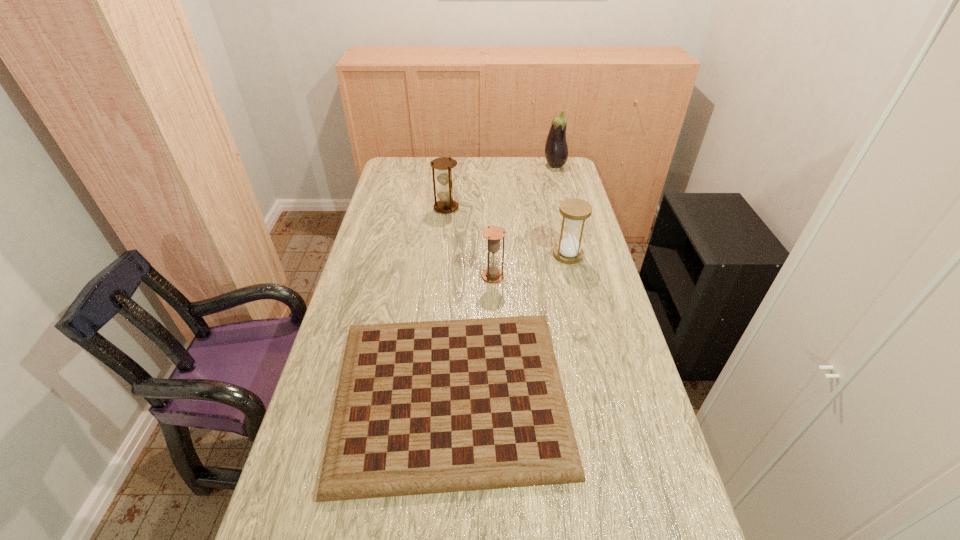
This screenshot has width=960, height=540. What are the coordinates of `blank region between the tallest object and the second hourglass from left to right` in the screenshot? It's located at (524, 221).

Identify which object is the fourth nearest to the farthest object. Please provide its 2D coordinates. Your answer should be formatted as a tuple, i.e. [(x, y)], where the tuple contains the x and y coordinates of a point satisfying the conditions above.

[(428, 407)]

Identify which object is the third closest to the gameboard. Please provide its 2D coordinates. Your answer should be formatted as a tuple, i.e. [(x, y)], where the tuple contains the x and y coordinates of a point satisfying the conditions above.

[(446, 204)]

Select which hourglass is the second closest to the fourth farthest object. Please provide its 2D coordinates. Your answer should be formatted as a tuple, i.e. [(x, y)], where the tuple contains the x and y coordinates of a point satisfying the conditions above.

[(446, 204)]

Where is `hourglass that stands as the second closest to the second farthest object`? The height and width of the screenshot is (540, 960). hourglass that stands as the second closest to the second farthest object is located at coordinates (575, 211).

Where is `free spot that satisfies the following two spatial constraints: 1. on the front side of the gameboard; 2. on the left side of the second farthest object`? free spot that satisfies the following two spatial constraints: 1. on the front side of the gameboard; 2. on the left side of the second farthest object is located at coordinates (427, 395).

Find the location of `free location that satisfies the following two spatial constraints: 1. on the back side of the eggplant; 2. on the right side of the rightmost hourglass`. free location that satisfies the following two spatial constraints: 1. on the back side of the eggplant; 2. on the right side of the rightmost hourglass is located at coordinates (547, 165).